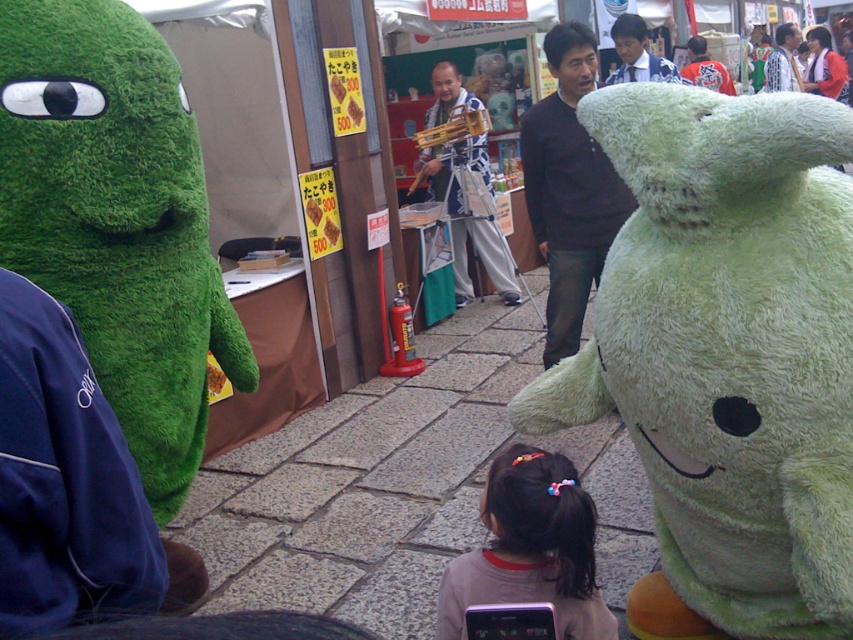
Can you confirm if blue and white patterned shirt at center is bigger than white shirt at upper right?

Incorrect, blue and white patterned shirt at center is not larger than white shirt at upper right.

Which is more to the right, blue and white patterned shirt at center or white shirt at upper right?

white shirt at upper right

Between point (621, 60) and point (801, 88), which one is positioned behind?

The point (801, 88) is more distant.

This screenshot has height=640, width=853. Find the location of `blue and white patterned shirt at center`. blue and white patterned shirt at center is located at coordinates (637, 52).

Which is behind, point (786, 604) or point (468, 96)?

The point (468, 96) is more distant.

Does point (602, 288) come farther from viewer compared to point (486, 224)?

That is False.

Which is behind, point (703, 371) or point (444, 179)?

Positioned behind is point (444, 179).

Image resolution: width=853 pixels, height=640 pixels. Identify the location of green plush toy at center. (726, 355).

Is green plush toy at center to the left of dark brown hair at center from the viewer's perspective?

No, green plush toy at center is not to the left of dark brown hair at center.

Is green plush toy at center to the right of dark brown hair at center from the viewer's perspective?

Indeed, green plush toy at center is positioned on the right side of dark brown hair at center.

Is point (666, 333) behind point (531, 548)?

That is False.

You are a GUI agent. You are given a task and a screenshot of the screen. Output one action in this format:
    pyautogui.click(x=<x>, y=<y>)
    Task: Click on the green plush toy at center
    The height and width of the screenshot is (640, 853).
    Given the screenshot: What is the action you would take?
    pyautogui.click(x=726, y=355)